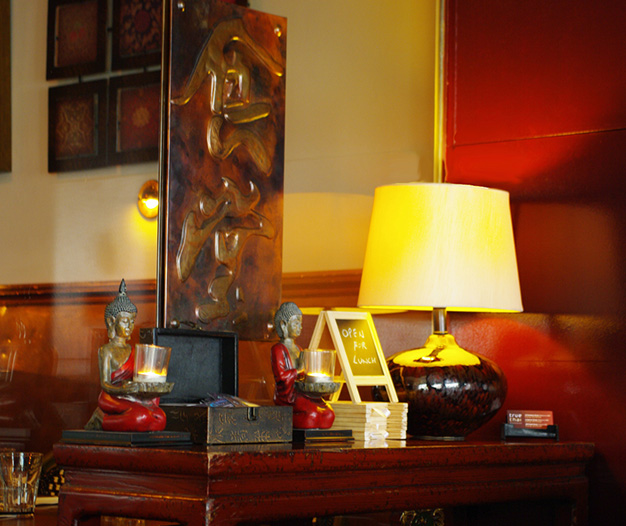
Image resolution: width=626 pixels, height=526 pixels. In order to click on white wall in this screenshot , I will do `click(337, 115)`, `click(52, 212)`.